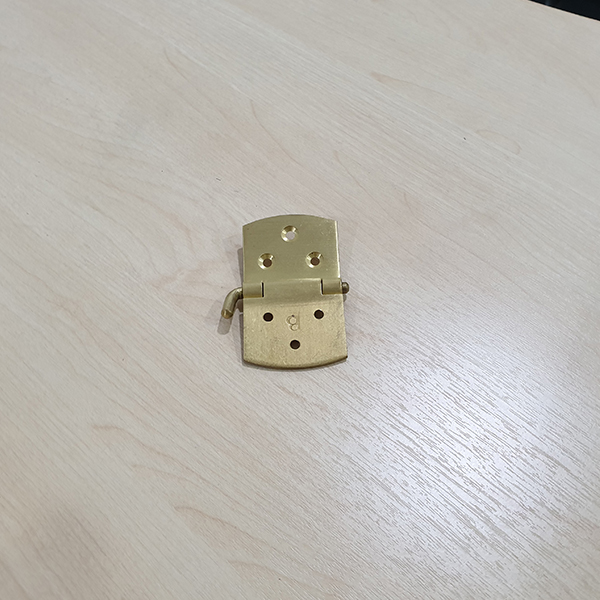
Locate an element on the screen. The width and height of the screenshot is (600, 600). upper part of hinge is located at coordinates (247, 238).